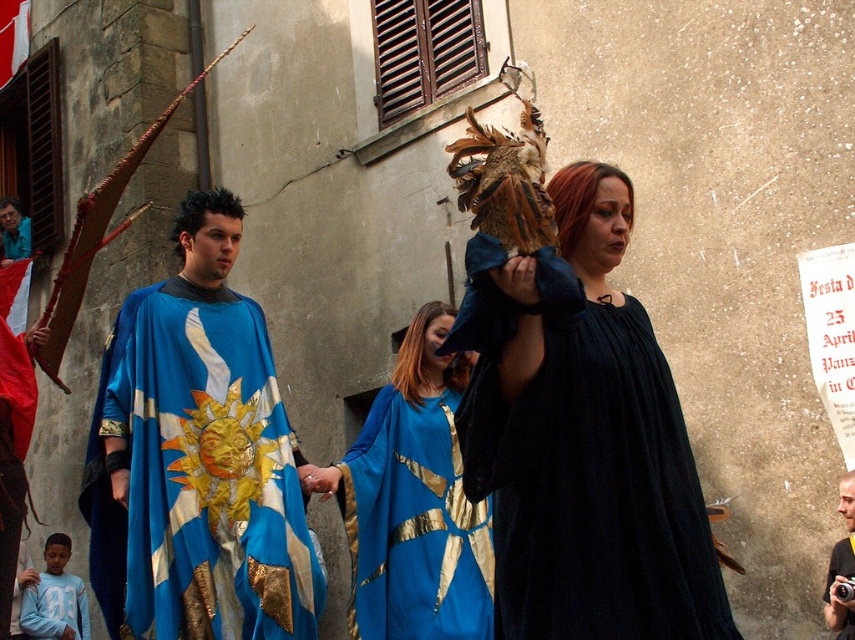
Question: Which object is the closest to the light blue cotton shirt at lower left?

Choices:
 (A) blue silk cape at center
 (B) shiny blue cape at center
 (C) blue satin cape at center
 (D) velvet dark blue dress at center

Answer: (A)

Question: Is velvet dark blue dress at center to the left of light blue cotton shirt at lower left from the viewer's perspective?

Choices:
 (A) yes
 (B) no

Answer: (B)

Question: Estimate the real-world distances between objects in this image. Which object is closer to the smooth silver camera at center?

Choices:
 (A) blue satin cape at center
 (B) blue silk cape at center

Answer: (A)

Question: In this image, where is smooth silver camera at center located relative to shiny blue cape at center?

Choices:
 (A) right
 (B) left

Answer: (A)

Question: Considering the real-world distances, which object is farthest from the shiny blue cape at center?

Choices:
 (A) light blue cotton shirt at lower left
 (B) smooth silver camera at center
 (C) blue silk cape at center

Answer: (B)

Question: Is light blue cotton shirt at lower left positioned at the back of smooth silver camera at center?

Choices:
 (A) no
 (B) yes

Answer: (B)